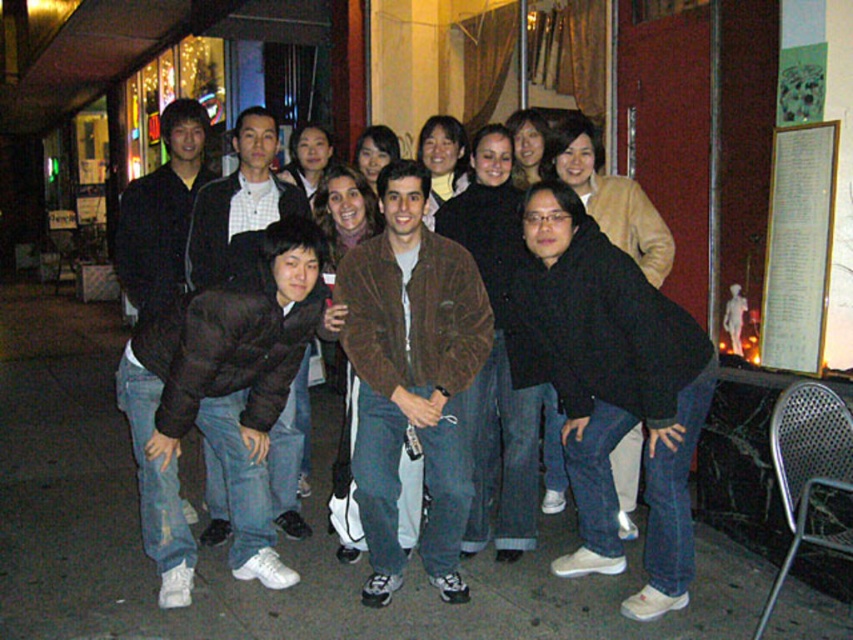
Question: Does brown suede jacket at center have a smaller size compared to brown fuzzy jacket at center?

Choices:
 (A) yes
 (B) no

Answer: (A)

Question: Which object is farther from the camera taking this photo?

Choices:
 (A) brown fuzzy jacket at center
 (B) dark brown puffy jacket at lower left

Answer: (A)

Question: Can you confirm if brown suede jacket at center is positioned above dark brown puffy jacket at lower left?

Choices:
 (A) yes
 (B) no

Answer: (A)

Question: Which point is closer to the camera?

Choices:
 (A) (212, 339)
 (B) (230, 198)

Answer: (A)

Question: Which point is closer to the camera taking this photo?

Choices:
 (A) (463, 292)
 (B) (169, 435)

Answer: (B)

Question: Can you confirm if brown suede jacket at center is positioned above dark brown puffy jacket at lower left?

Choices:
 (A) yes
 (B) no

Answer: (A)